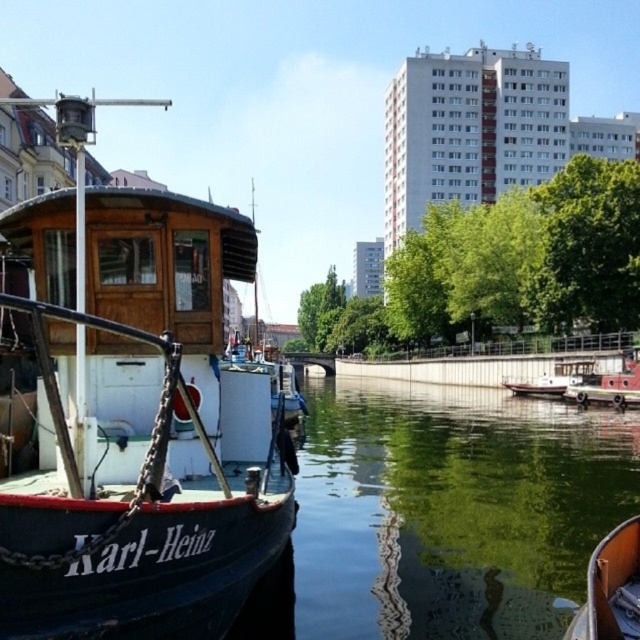
In the scene shown: Between wooden boat at center and red metal boat at right, which one has more height?

Standing taller between the two is red metal boat at right.

Between wooden boat at center and red metal boat at right, which one is positioned lower?

wooden boat at center

This screenshot has height=640, width=640. Identify the location of wooden boat at center. (611, 588).

You are a GUI agent. You are given a task and a screenshot of the screen. Output one action in this format:
    pyautogui.click(x=<x>, y=<y>)
    Task: Click on the wooden boat at center
    Image resolution: width=640 pixels, height=640 pixels.
    Given the screenshot: What is the action you would take?
    point(611,588)

Is wooden cabin boat at left shorter than wooden boat at center?

No, wooden cabin boat at left is not shorter than wooden boat at center.

Can you confirm if wooden cabin boat at left is bigger than wooden boat at center?

Correct, wooden cabin boat at left is larger in size than wooden boat at center.

Identify the location of wooden cabin boat at left. (138, 416).

The image size is (640, 640). Find the location of `wooden cabin boat at left`. wooden cabin boat at left is located at coordinates (138, 416).

Can you confirm if red metal boat at right is taller than white glossy boat at center?

Correct, red metal boat at right is much taller as white glossy boat at center.

Is point (570, 396) more distant than point (544, 396)?

That is False.

This screenshot has width=640, height=640. What are the coordinates of `red metal boat at right` in the screenshot? It's located at (609, 385).